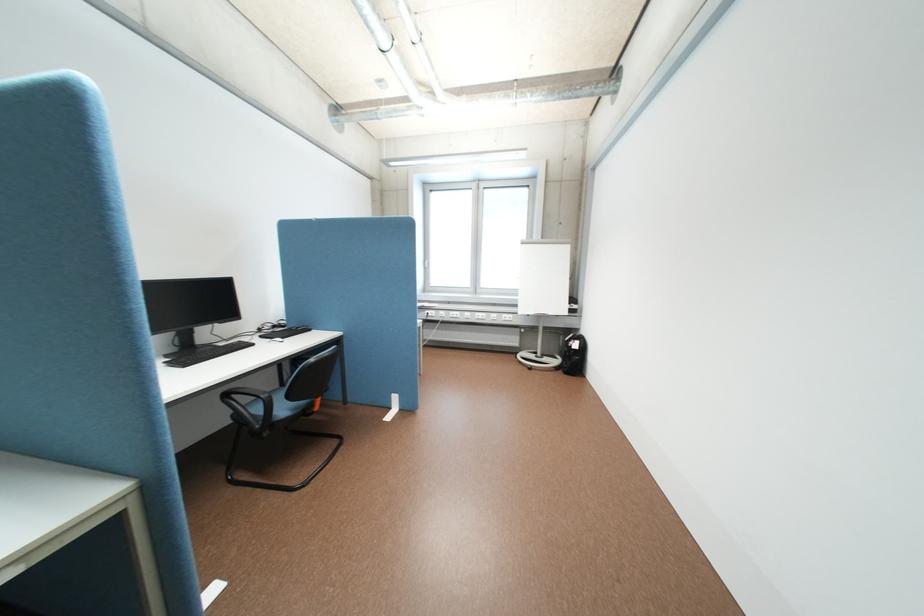
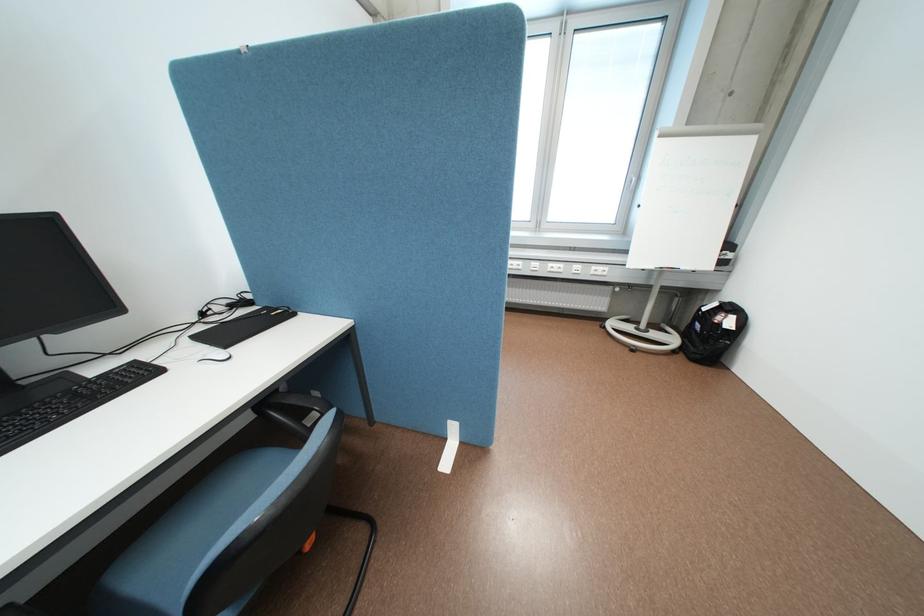
Find the pixel in the second image that matches point 570,371 in the first image.

(691, 357)